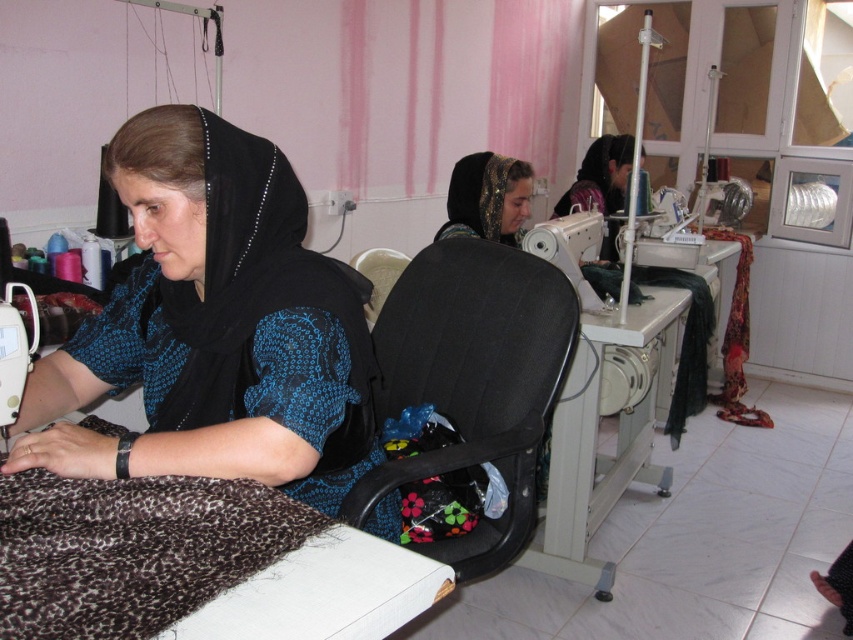
Question: Is black lace dress at left to the left of matte black headscarf at center from the viewer's perspective?

Choices:
 (A) no
 (B) yes

Answer: (B)

Question: Which object is positioned farthest from the matte black sewing machine at upper right?

Choices:
 (A) matte black headscarf at center
 (B) metallic gray sewing machine at center
 (C) black lace dress at left

Answer: (C)

Question: Considering the relative positions of metallic gray sewing machine at center and matte black headscarf at center in the image provided, where is metallic gray sewing machine at center located with respect to matte black headscarf at center?

Choices:
 (A) left
 (B) right

Answer: (B)

Question: Does matte black headscarf at center have a smaller size compared to matte black sewing machine at upper right?

Choices:
 (A) yes
 (B) no

Answer: (A)

Question: Estimate the real-world distances between objects in this image. Which object is farther from the matte black sewing machine at upper right?

Choices:
 (A) metallic gray sewing machine at center
 (B) black lace dress at left

Answer: (B)

Question: Which of the following is the closest to the observer?

Choices:
 (A) (154, 472)
 (B) (627, 484)

Answer: (A)